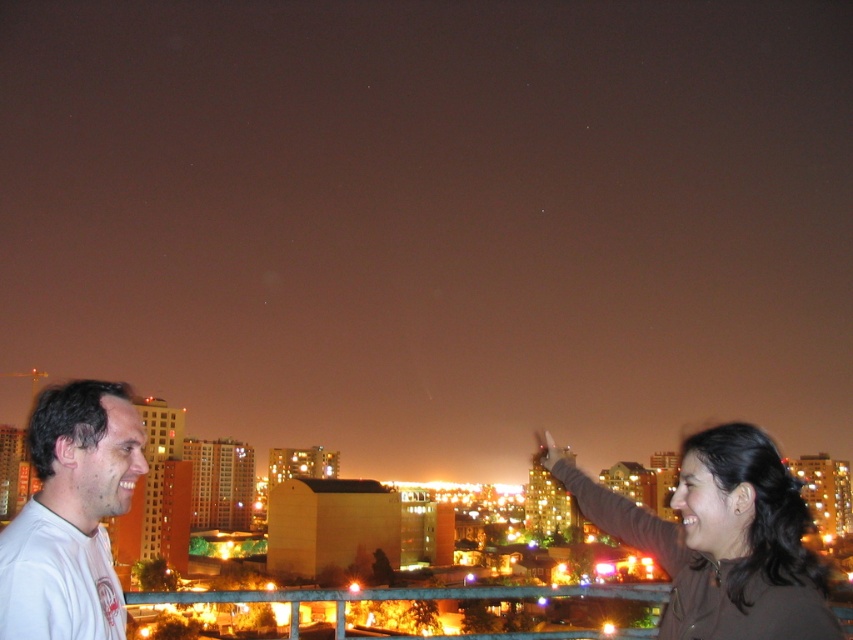
Can you confirm if brown matte jacket at upper right is positioned to the right of white cotton t-shirt at lower left?

Yes, brown matte jacket at upper right is to the right of white cotton t-shirt at lower left.

Identify the location of brown matte jacket at upper right. This screenshot has width=853, height=640. (718, 540).

Is point (701, 627) behind point (45, 518)?

Yes, point (701, 627) is farther from viewer.

Locate an element on the screen. Image resolution: width=853 pixels, height=640 pixels. brown matte jacket at upper right is located at coordinates (718, 540).